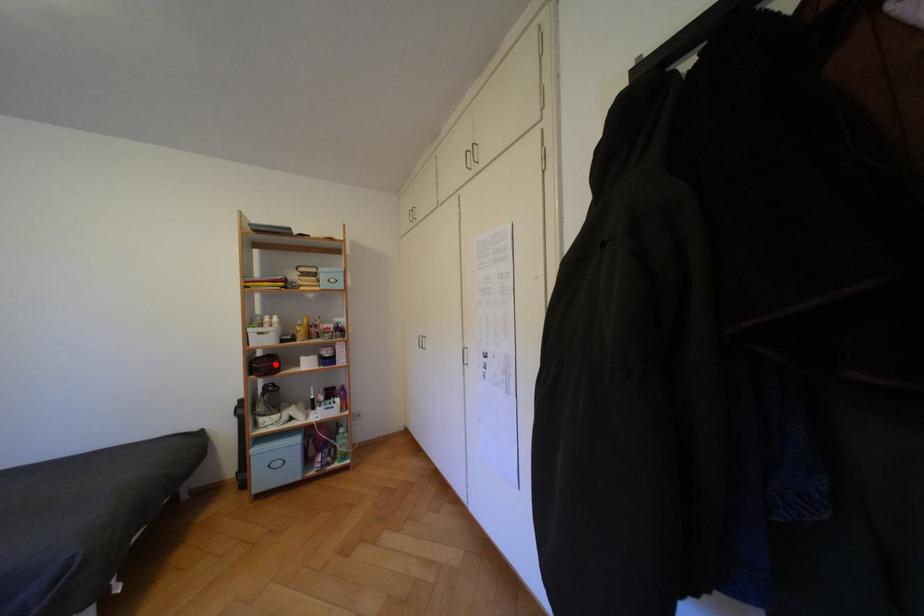
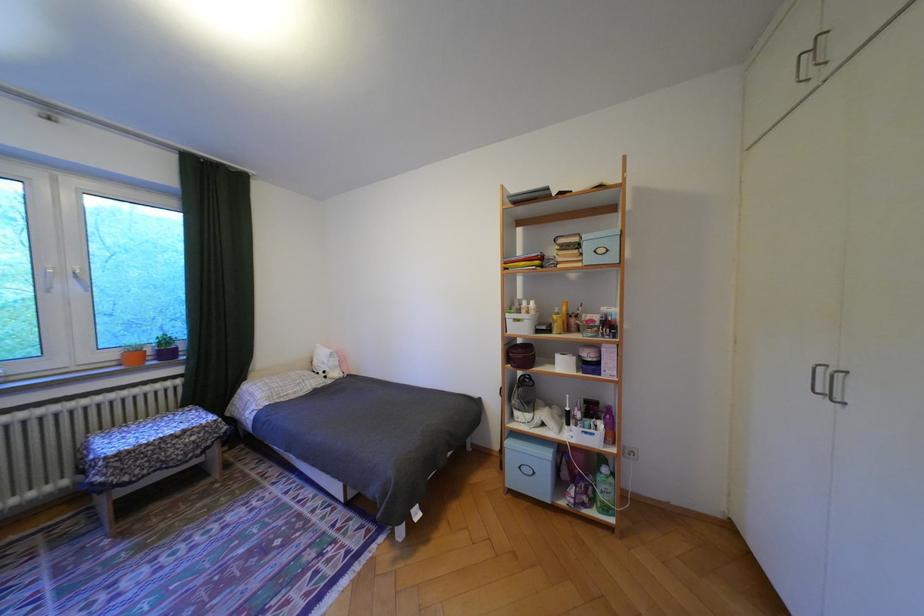
Question: I am providing you with two images of the same scene from different viewpoints. A red point is marked on the first image. Is the red point's position out of view in image 2?

Choices:
 (A) Yes
 (B) No

Answer: (B)